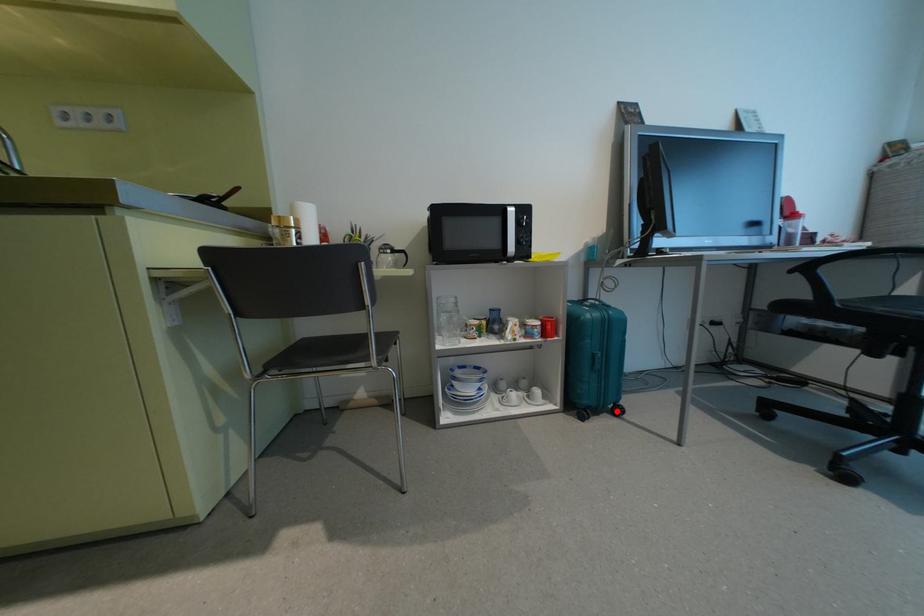
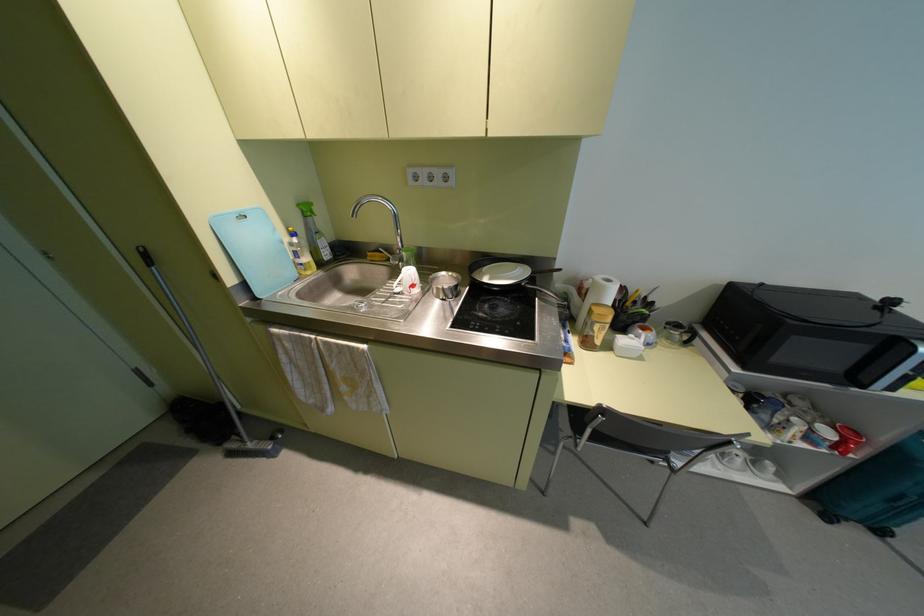
Find the pixel in the second image that matches the highlighted location in the first image.

(880, 531)